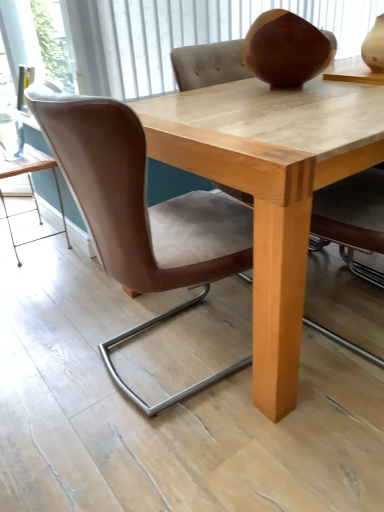
Image resolution: width=384 pixels, height=512 pixels. Find the location of `free point below brown leather chair at center (from a real-world perspective)`. free point below brown leather chair at center (from a real-world perspective) is located at coordinates (155, 360).